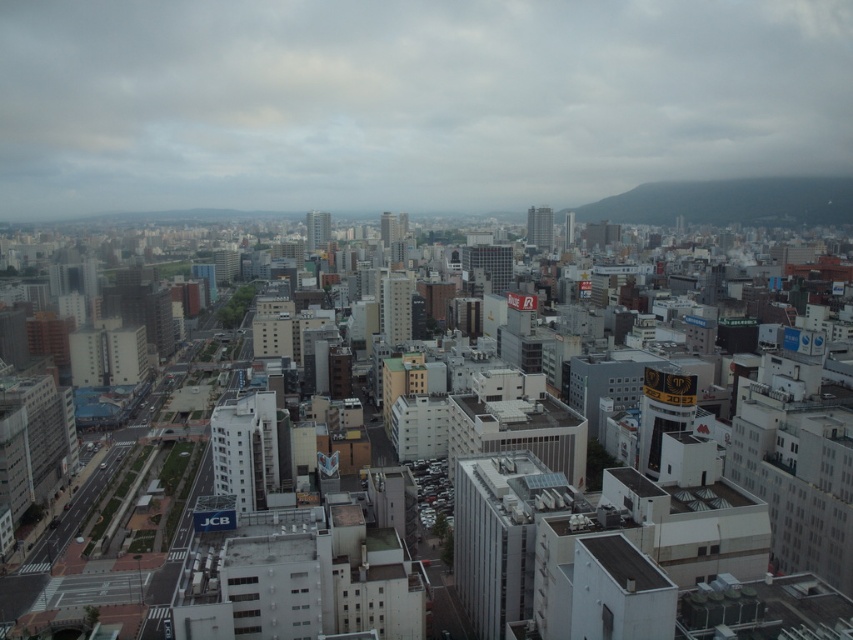
You are standing at the center of the city and looking out towards the horizon. You notice a white matte building at center. Based on its position in the image, can you estimate its coordinates in the 2D plane?

The white matte building at center is located at coordinates approximately 0.809 on the x axis and 0.689 on the y axis in the 2D plane.

You are a drone operator planning to fly a drone from the white matte building at center to the green grassy hill at upper right. According to the image, what is the approximate distance you need to cover?

The distance between the white matte building at center and the green grassy hill at upper right is approximately 424.18 meters.